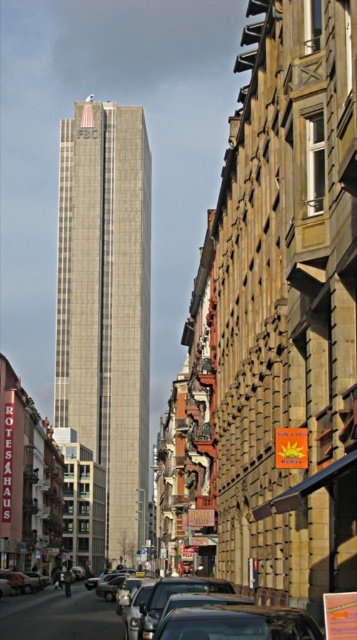
Is beige stone skyscraper at center above shiny silver car at lower center?

Indeed, beige stone skyscraper at center is positioned over shiny silver car at lower center.

Who is positioned more to the left, beige stone skyscraper at center or shiny silver car at lower center?

From the viewer's perspective, beige stone skyscraper at center appears more on the left side.

What do you see at coordinates (106, 305) in the screenshot? I see `beige stone skyscraper at center` at bounding box center [106, 305].

Locate an element on the screen. beige stone skyscraper at center is located at coordinates (106, 305).